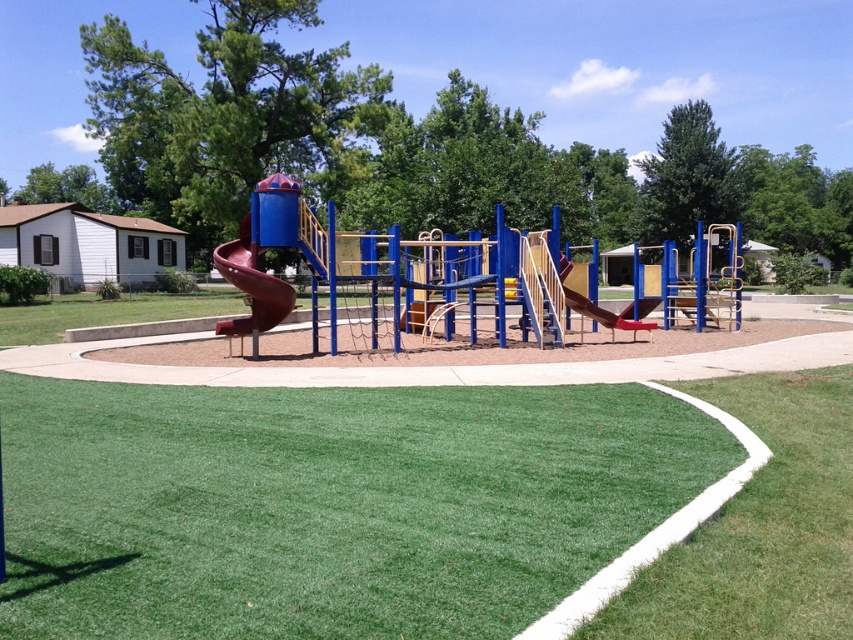
Question: Does green turf at lower right lie in front of brown matte slide at center?

Choices:
 (A) no
 (B) yes

Answer: (B)

Question: Among these objects, which one is nearest to the camera?

Choices:
 (A) green turf at lower right
 (B) rubberized smooth slide at center-left
 (C) brown matte slide at center

Answer: (A)

Question: Does rubberized smooth slide at center-left come in front of brown matte slide at center?

Choices:
 (A) no
 (B) yes

Answer: (B)

Question: Which object is farther from the camera taking this photo?

Choices:
 (A) brown matte slide at center
 (B) green turf at lower right
 (C) rubberized smooth slide at center-left

Answer: (A)

Question: Based on their relative distances, which object is farther from the brown matte slide at center?

Choices:
 (A) green turf at lower right
 (B) rubberized smooth slide at center-left

Answer: (A)

Question: Can you confirm if rubberized smooth slide at center-left is wider than brown matte slide at center?

Choices:
 (A) yes
 (B) no

Answer: (A)